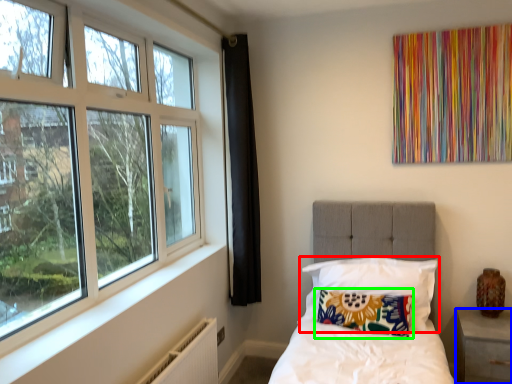
Question: Which object is the farthest from pillow (highlighted by a red box)? Choose among these: nightstand (highlighted by a blue box) or pillow (highlighted by a green box).

Choices:
 (A) nightstand
 (B) pillow

Answer: (A)